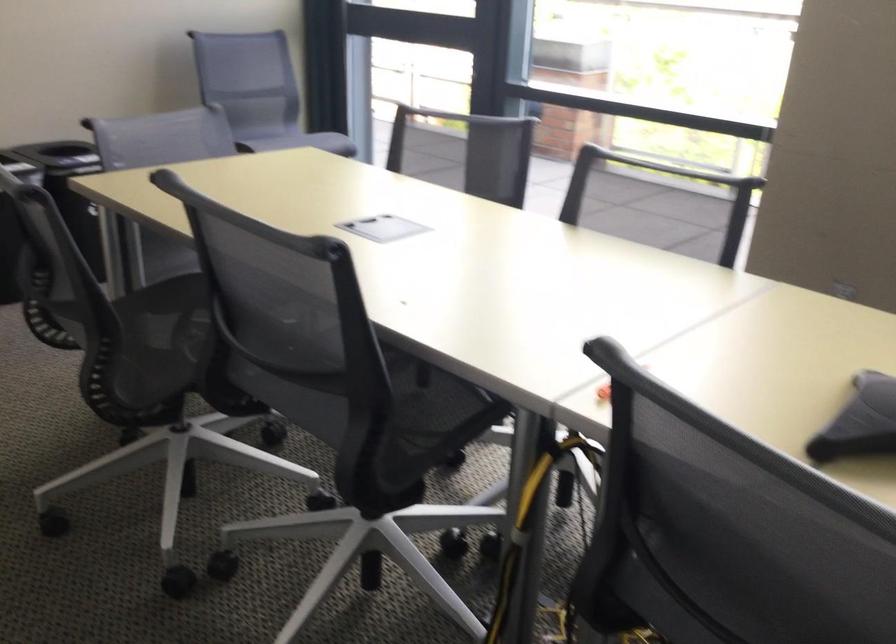
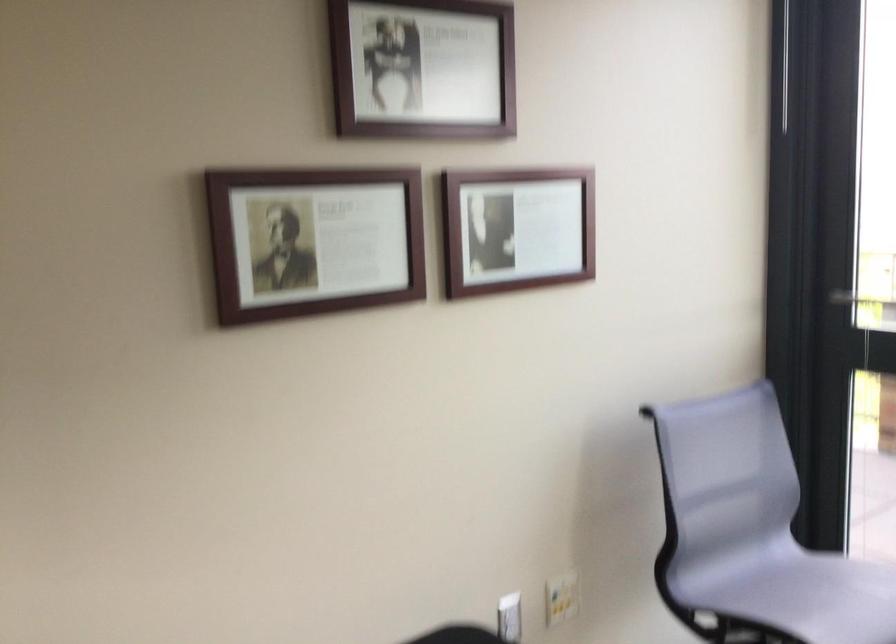
What movement of the cameraman would produce the second image?

The movement direction of the cameraman is left, forward.